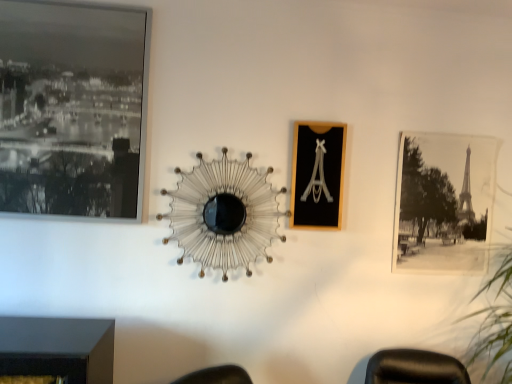
Question: Are metallic wire at center and black wood picture frame at center, the 2th picture frame from the front, far apart?

Choices:
 (A) no
 (B) yes

Answer: (A)

Question: Is metallic wire at center positioned behind black wood picture frame at center, the second picture frame in the right-to-left sequence?

Choices:
 (A) no
 (B) yes

Answer: (A)

Question: Considering the relative sizes of metallic wire at center and black wood picture frame at center, placed as the 2th picture frame when sorted from left to right, in the image provided, is metallic wire at center taller than black wood picture frame at center, placed as the 2th picture frame when sorted from left to right,?

Choices:
 (A) no
 (B) yes

Answer: (B)

Question: From the image's perspective, is metallic wire at center beneath black wood picture frame at center, placed as the 2th picture frame when sorted from left to right?

Choices:
 (A) no
 (B) yes

Answer: (B)

Question: Is metallic wire at center aimed at black wood picture frame at center, placed as the 2th picture frame when sorted from left to right?

Choices:
 (A) yes
 (B) no

Answer: (B)

Question: Would you say black paper photo at right, marked as the third picture frame in a front-to-back arrangement, is inside or outside black glass picture frame at upper left, the 3th picture frame positioned from the right?

Choices:
 (A) outside
 (B) inside

Answer: (A)

Question: Based on their positions, is black paper photo at right, which ranks as the 1th picture frame in right-to-left order, located to the left or right of black glass picture frame at upper left, which ranks as the 1th picture frame in front-to-back order?

Choices:
 (A) left
 (B) right

Answer: (B)

Question: From a real-world perspective, is black paper photo at right, marked as the third picture frame in a front-to-back arrangement, physically located above or below black glass picture frame at upper left, the 3th picture frame positioned from the right?

Choices:
 (A) below
 (B) above

Answer: (A)

Question: From the image's perspective, is black paper photo at right, the first picture frame from the back, located above or below black glass picture frame at upper left, positioned as the 3th picture frame in back-to-front order?

Choices:
 (A) below
 (B) above

Answer: (A)

Question: From the image's perspective, is black wood picture frame at center, placed as the 2th picture frame when sorted from left to right, located above or below black glass picture frame at upper left, which ranks as the 1th picture frame in front-to-back order?

Choices:
 (A) above
 (B) below

Answer: (B)

Question: Considering the positions of black wood picture frame at center, the second picture frame in the right-to-left sequence, and black glass picture frame at upper left, marked as the first picture frame in a left-to-right arrangement, in the image, is black wood picture frame at center, the second picture frame in the right-to-left sequence, wider or thinner than black glass picture frame at upper left, marked as the first picture frame in a left-to-right arrangement,?

Choices:
 (A) thin
 (B) wide

Answer: (A)

Question: Is point (310, 183) closer or farther from the camera than point (108, 147)?

Choices:
 (A) closer
 (B) farther

Answer: (B)

Question: In the image, is black wood picture frame at center, acting as the second picture frame starting from the back, positioned in front of or behind black glass picture frame at upper left, positioned as the 3th picture frame in back-to-front order?

Choices:
 (A) behind
 (B) front

Answer: (A)

Question: From the image's perspective, is metallic wire at center located above or below black glass picture frame at upper left, which ranks as the 1th picture frame in front-to-back order?

Choices:
 (A) above
 (B) below

Answer: (B)

Question: In terms of size, does metallic wire at center appear bigger or smaller than black glass picture frame at upper left, marked as the first picture frame in a left-to-right arrangement?

Choices:
 (A) big
 (B) small

Answer: (B)